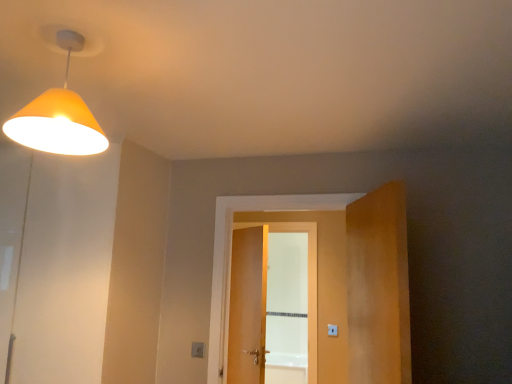
Describe the element at coordinates (58, 116) in the screenshot. I see `orange matte lampshade at upper left` at that location.

Find the location of `orange matte lampshade at upper left`. orange matte lampshade at upper left is located at coordinates (58, 116).

Is white plastic light switch at lower center to the right of wooden door at center from the viewer's perspective?

Incorrect, white plastic light switch at lower center is not on the right side of wooden door at center.

Does white plastic light switch at lower center lie behind wooden door at center?

Yes, the depth of white plastic light switch at lower center is greater than that of wooden door at center.

Which object is wider, white plastic light switch at lower center or wooden door at center?

wooden door at center is wider.

Considering the sizes of white plastic light switch at lower center and wooden door at center in the image, is white plastic light switch at lower center taller or shorter than wooden door at center?

In the image, white plastic light switch at lower center appears to be shorter than wooden door at center.

Considering the relative sizes of orange matte lampshade at upper left and wooden door at center in the image provided, is orange matte lampshade at upper left smaller than wooden door at center?

Yes, orange matte lampshade at upper left is smaller than wooden door at center.

Is orange matte lampshade at upper left further to camera compared to wooden door at center?

No, orange matte lampshade at upper left is closer to the viewer.

From the image's perspective, is orange matte lampshade at upper left above wooden door at center?

Yes.

Would you say orange matte lampshade at upper left is inside or outside wooden door at center?

orange matte lampshade at upper left is outside wooden door at center.

In the scene shown: From the image's perspective, which object appears higher, wooden door at center or orange matte lampshade at upper left?

From the image's view, orange matte lampshade at upper left is above.

Is wooden door at center bigger than orange matte lampshade at upper left?

Yes.

Can you confirm if wooden door at center is positioned to the right of orange matte lampshade at upper left?

Yes, wooden door at center is to the right of orange matte lampshade at upper left.

From a real-world perspective, is wooden door at center positioned above or below orange matte lampshade at upper left?

wooden door at center is below orange matte lampshade at upper left.

From a real-world perspective, is white plastic light switch at lower center located higher than orange matte lampshade at upper left?

No, from a real-world perspective, white plastic light switch at lower center is not above orange matte lampshade at upper left.

Based on their sizes in the image, would you say white plastic light switch at lower center is bigger or smaller than orange matte lampshade at upper left?

In the image, white plastic light switch at lower center appears to be smaller than orange matte lampshade at upper left.

Does white plastic light switch at lower center touch orange matte lampshade at upper left?

No.

From the image's perspective, relative to orange matte lampshade at upper left, is white plastic light switch at lower center above or below?

white plastic light switch at lower center is below orange matte lampshade at upper left.

Considering the relative positions of wooden door at center and white plastic light switch at lower center in the image provided, is wooden door at center in front of white plastic light switch at lower center?

Yes, the depth of wooden door at center is less than that of white plastic light switch at lower center.

Is wooden door at center in contact with white plastic light switch at lower center?

wooden door at center and white plastic light switch at lower center are clearly separated.

Is wooden door at center wider or thinner than white plastic light switch at lower center?

Clearly, wooden door at center has more width compared to white plastic light switch at lower center.

From the image's perspective, which one is positioned lower, orange matte lampshade at upper left or white plastic light switch at lower center?

white plastic light switch at lower center.

Can you confirm if orange matte lampshade at upper left is positioned to the left of white plastic light switch at lower center?

Correct, you'll find orange matte lampshade at upper left to the left of white plastic light switch at lower center.

From a real-world perspective, which is physically below, orange matte lampshade at upper left or white plastic light switch at lower center?

white plastic light switch at lower center.

Does orange matte lampshade at upper left have a larger size compared to white plastic light switch at lower center?

Correct, orange matte lampshade at upper left is larger in size than white plastic light switch at lower center.

I want to click on light switch located underneath the wooden door at center (from a real-world perspective), so click(x=197, y=349).

Where is `door on the right of orange matte lampshade at upper left`? The width and height of the screenshot is (512, 384). door on the right of orange matte lampshade at upper left is located at coordinates tap(335, 278).

Estimate the real-world distances between objects in this image. Which object is closer to wooden door at center, white plastic light switch at lower center or orange matte lampshade at upper left?

Based on the image, white plastic light switch at lower center appears to be nearer to wooden door at center.

From the picture: Considering their positions, is orange matte lampshade at upper left positioned closer to wooden door at center than white plastic light switch at lower center?

white plastic light switch at lower center lies closer to wooden door at center than the other object.

Considering their positions, is orange matte lampshade at upper left positioned further to white plastic light switch at lower center than wooden door at center?

orange matte lampshade at upper left.

Estimate the real-world distances between objects in this image. Which object is further from white plastic light switch at lower center, wooden door at center or orange matte lampshade at upper left?

Among the two, orange matte lampshade at upper left is located further to white plastic light switch at lower center.

From the image, which object appears to be farther from orange matte lampshade at upper left, white plastic light switch at lower center or wooden door at center?

Among the two, white plastic light switch at lower center is located further to orange matte lampshade at upper left.

When comparing their distances from orange matte lampshade at upper left, does wooden door at center or white plastic light switch at lower center seem closer?

Based on the image, wooden door at center appears to be nearer to orange matte lampshade at upper left.

In order to click on door positioned between orange matte lampshade at upper left and white plastic light switch at lower center from near to far in this screenshot , I will do (335, 278).